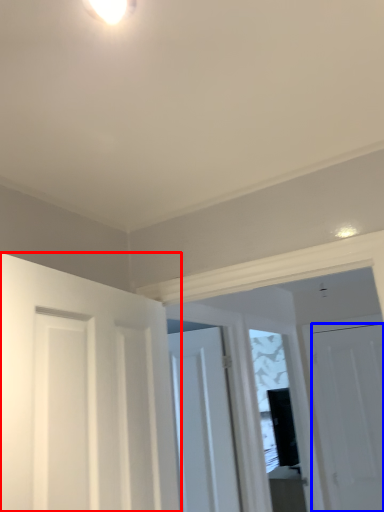
Question: Which of the following is the closest to the observer, door (highlighted by a red box) or door (highlighted by a blue box)?

Choices:
 (A) door
 (B) door

Answer: (A)